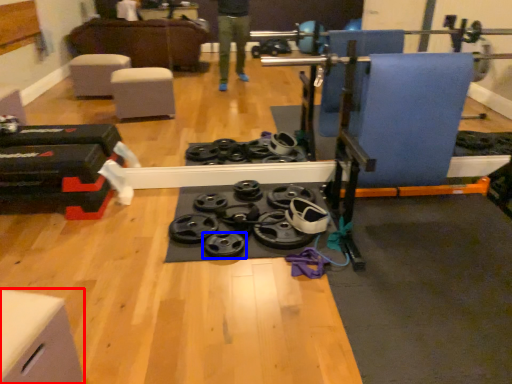
Question: Which object is closer to the camera taking this photo, furniture (highlighted by a red box) or wheel (highlighted by a blue box)?

Choices:
 (A) furniture
 (B) wheel

Answer: (A)